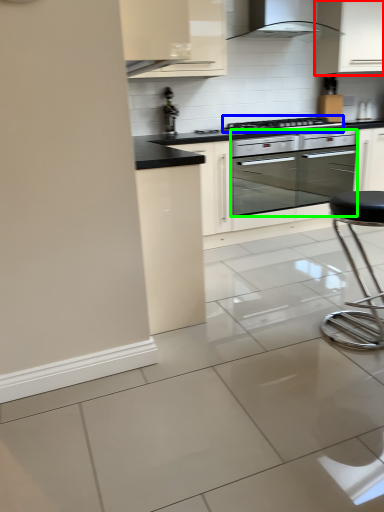
Question: Which object is the farthest from cabinetry (highlighted by a red box)? Choose among these: kitchen appliance (highlighted by a blue box) or oven (highlighted by a green box).

Choices:
 (A) kitchen appliance
 (B) oven

Answer: (B)